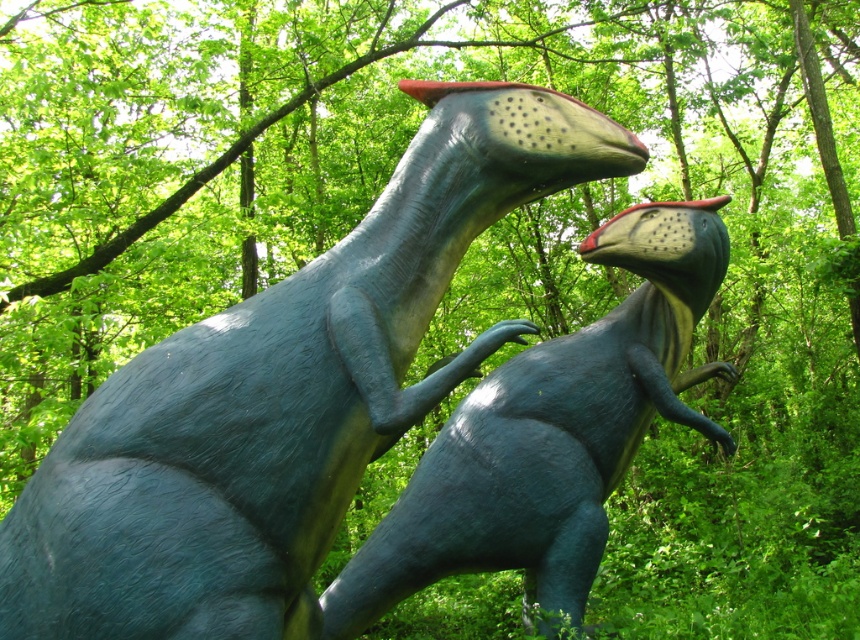
Can you confirm if matte blue dinosaur at center is thinner than shiny blue dinosaur at center?

Yes, matte blue dinosaur at center is thinner than shiny blue dinosaur at center.

Does matte blue dinosaur at center have a lesser height compared to shiny blue dinosaur at center?

Yes, matte blue dinosaur at center is shorter than shiny blue dinosaur at center.

Which is in front, point (62, 451) or point (621, 433)?

Point (62, 451) is more forward.

Locate an element on the screen. This screenshot has height=640, width=860. matte blue dinosaur at center is located at coordinates (281, 397).